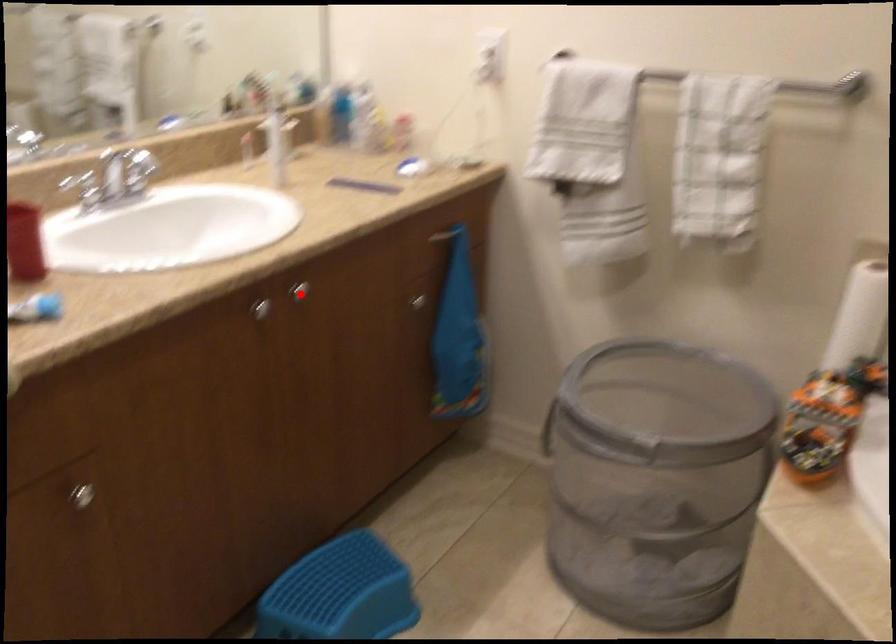
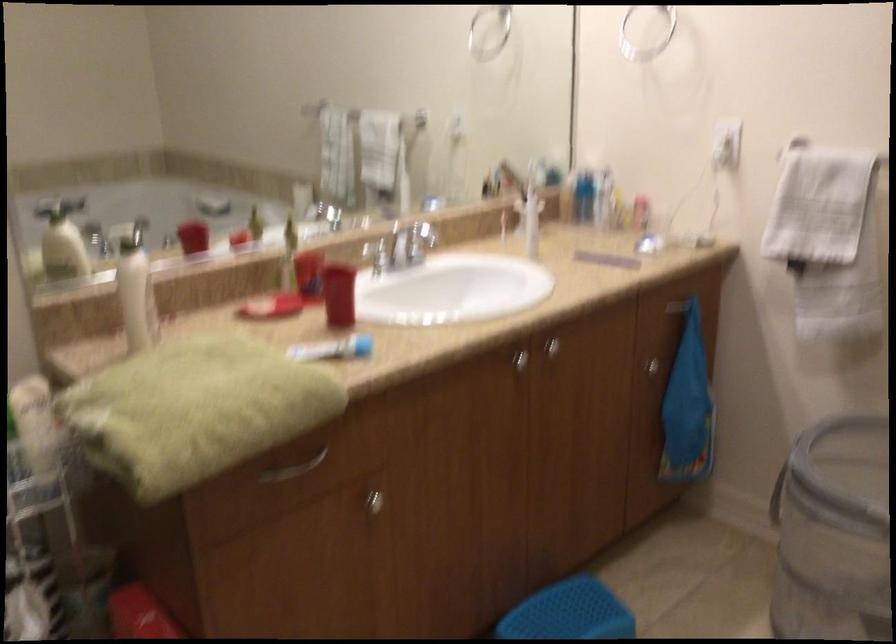
In the second image, find the point that corresponds to the highlighted location in the first image.

(552, 348)